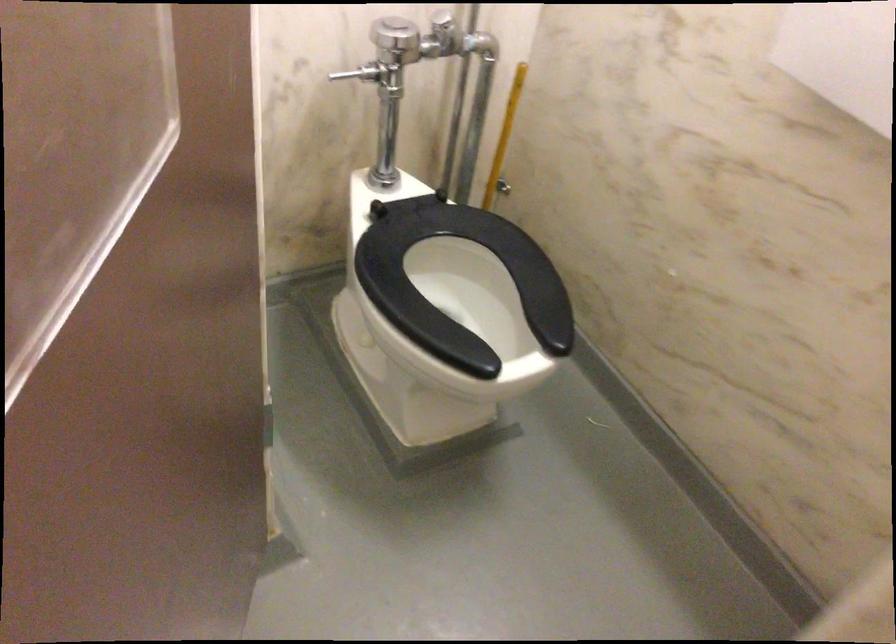
The image size is (896, 644). What do you see at coordinates (461, 285) in the screenshot? I see `the black toilet seat` at bounding box center [461, 285].